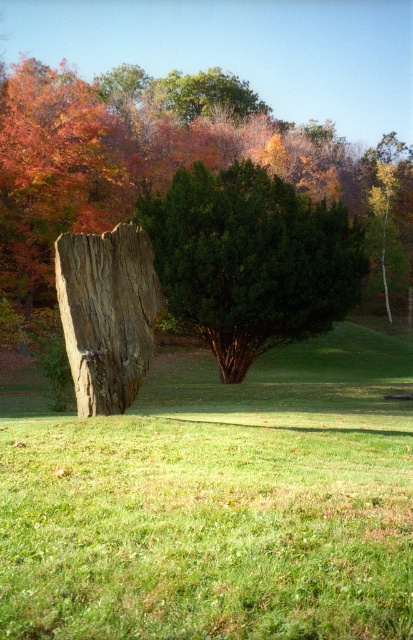
How distant is green grass at center from green matte tree at center?

green grass at center and green matte tree at center are 4.99 meters apart from each other.

This screenshot has width=413, height=640. I want to click on green grass at center, so (x=215, y=500).

This screenshot has height=640, width=413. Find the location of `green grass at center`. green grass at center is located at coordinates (215, 500).

Between wooden stump at center and green leafy tree at upper center, which one is positioned lower?

wooden stump at center

Is wooden stump at center taller than green leafy tree at upper center?

In fact, wooden stump at center may be shorter than green leafy tree at upper center.

Is point (116, 236) closer to camera compared to point (239, 97)?

Yes.

Image resolution: width=413 pixels, height=640 pixels. I want to click on wooden stump at center, so click(x=108, y=314).

Does green matte tree at center have a lesser width compared to wooden stump at center?

In fact, green matte tree at center might be wider than wooden stump at center.

Who is more forward, [220,250] or [92,352]?

Point [92,352]

Find the location of a particular element. green matte tree at center is located at coordinates (251, 259).